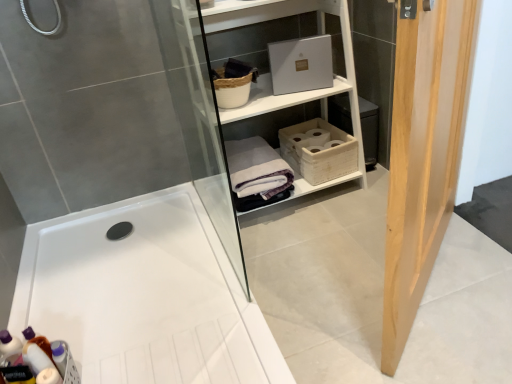
Question: Is translucent plastic bottles at lower left not near white glossy bathtub at center?

Choices:
 (A) yes
 (B) no

Answer: (B)

Question: Is translucent plastic bottles at lower left thinner than white glossy bathtub at center?

Choices:
 (A) no
 (B) yes

Answer: (B)

Question: Is translucent plastic bottles at lower left oriented towards white glossy bathtub at center?

Choices:
 (A) yes
 (B) no

Answer: (B)

Question: Can you confirm if translucent plastic bottles at lower left is positioned to the left of white glossy bathtub at center?

Choices:
 (A) yes
 (B) no

Answer: (A)

Question: Is the depth of translucent plastic bottles at lower left greater than that of white glossy bathtub at center?

Choices:
 (A) yes
 (B) no

Answer: (A)

Question: Is translucent plastic bottles at lower left inside the boundaries of white cotton bath towel at center, or outside?

Choices:
 (A) inside
 (B) outside

Answer: (B)

Question: Does point (49, 380) appear closer or farther from the camera than point (269, 170)?

Choices:
 (A) closer
 (B) farther

Answer: (A)

Question: Is translucent plastic bottles at lower left wider or thinner than white cotton bath towel at center?

Choices:
 (A) wide
 (B) thin

Answer: (B)

Question: Is translucent plastic bottles at lower left taller or shorter than white cotton bath towel at center?

Choices:
 (A) short
 (B) tall

Answer: (B)

Question: Is white woven basket at center, marked as the 1th basket in a right-to-left arrangement, wider or thinner than white matte shelf at upper center?

Choices:
 (A) thin
 (B) wide

Answer: (A)

Question: From a real-world perspective, is white woven basket at center, marked as the 1th basket in a right-to-left arrangement, positioned above or below white matte shelf at upper center?

Choices:
 (A) below
 (B) above

Answer: (A)

Question: Considering the relative positions of white woven basket at center, which is the 1th basket in bottom-to-top order, and white matte shelf at upper center in the image provided, is white woven basket at center, which is the 1th basket in bottom-to-top order, to the left or to the right of white matte shelf at upper center?

Choices:
 (A) right
 (B) left

Answer: (A)

Question: Considering the positions of white woven basket at center, the 2th basket from the left, and white matte shelf at upper center in the image, is white woven basket at center, the 2th basket from the left, taller or shorter than white matte shelf at upper center?

Choices:
 (A) tall
 (B) short

Answer: (B)

Question: From a real-world perspective, is light wood door at right above or below white woven basket at center, which is the 1th basket in bottom-to-top order?

Choices:
 (A) below
 (B) above

Answer: (B)

Question: From the image's perspective, is light wood door at right positioned above or below white woven basket at center, marked as the 1th basket in a right-to-left arrangement?

Choices:
 (A) below
 (B) above

Answer: (A)